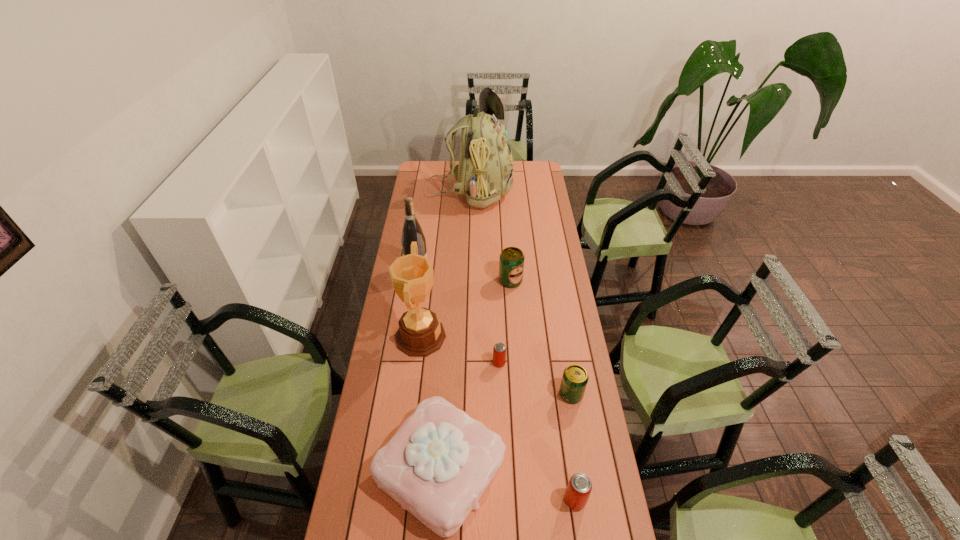
Locate an element on the screen. The image size is (960, 540). the farthest object is located at coordinates (485, 171).

Locate an element on the screen. This screenshot has width=960, height=540. the tallest object is located at coordinates (485, 171).

The height and width of the screenshot is (540, 960). Identify the location of wine bottle. (412, 232).

Where is `award`? Image resolution: width=960 pixels, height=540 pixels. award is located at coordinates (420, 333).

At what (x,y) coordinates should I click in order to perform the action: click on the left green beer can. Please return your answer as a coordinate pair (x, y). This screenshot has width=960, height=540. Looking at the image, I should click on pyautogui.click(x=511, y=262).

Locate an element on the screen. the farthest beer can is located at coordinates (511, 262).

At what (x,y) coordinates should I click in order to perform the action: click on the third farthest beer can. Please return your answer as a coordinate pair (x, y). The image size is (960, 540). Looking at the image, I should click on (575, 378).

The image size is (960, 540). What are the coordinates of `the right green beer can` in the screenshot? It's located at (575, 378).

Find the location of a particular element. the right pink beer can is located at coordinates (578, 490).

Locate an element on the screen. The width and height of the screenshot is (960, 540). the nearest beer can is located at coordinates (578, 490).